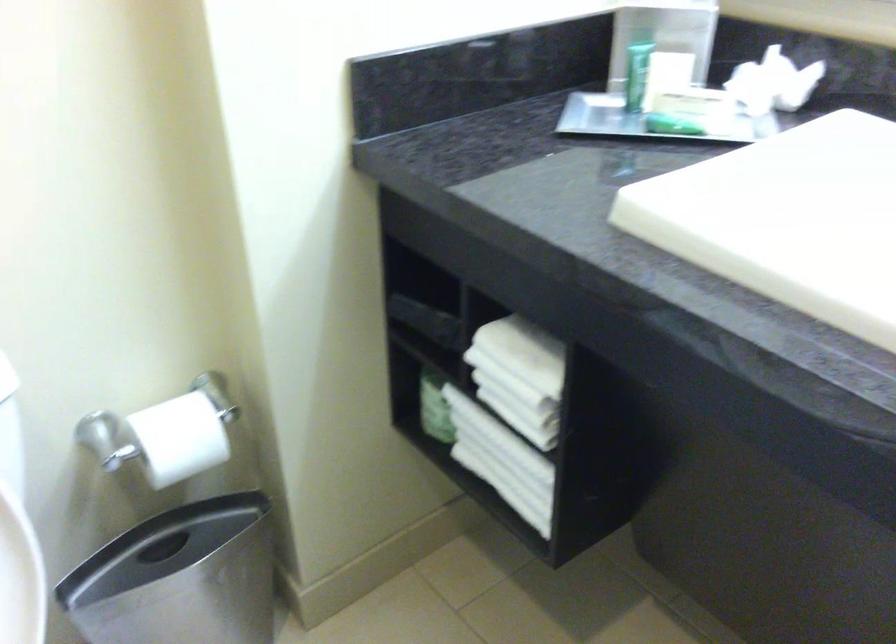
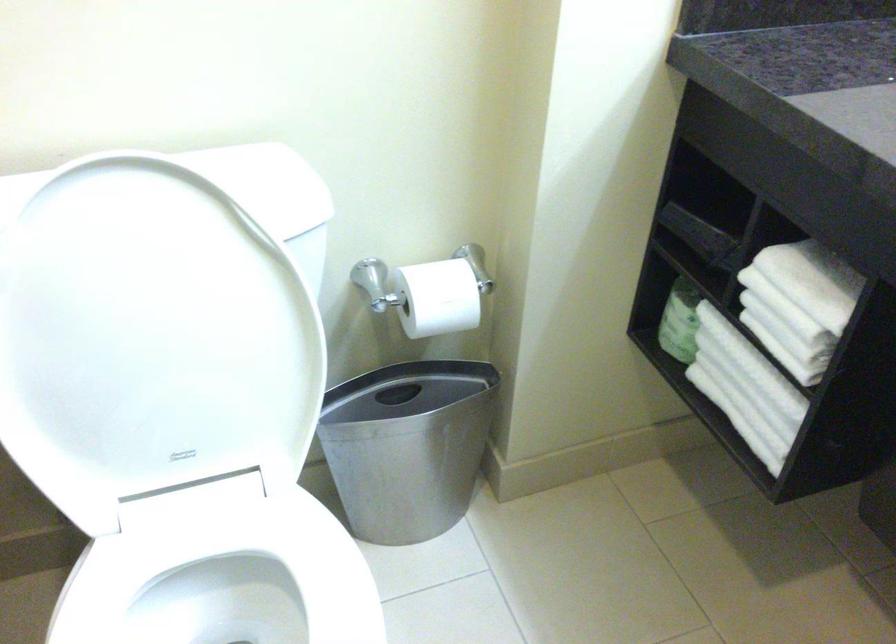
Find the pixel in the second image that matches point (176, 440) in the first image.

(436, 298)